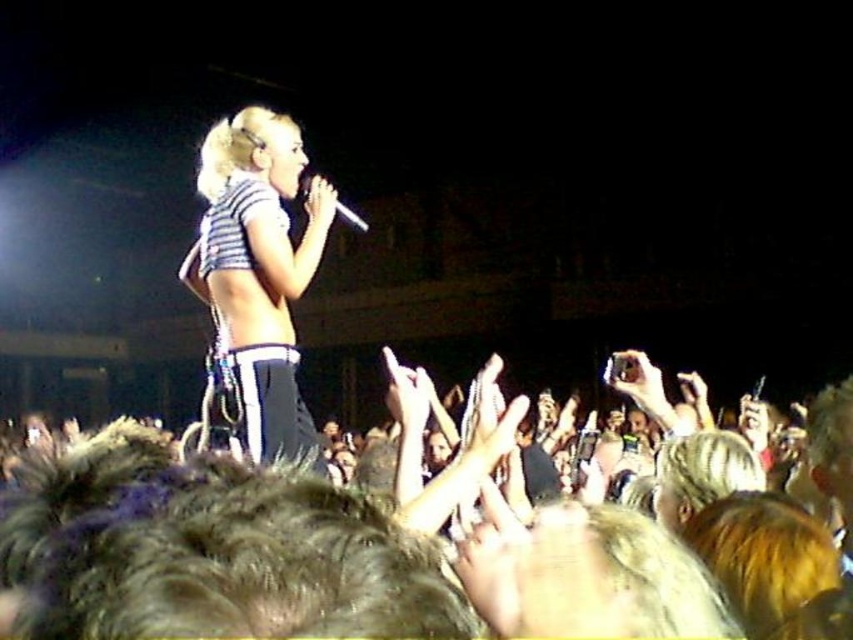
You are a photographer at the concert and want to capture the performer. Which object, the striped fabric top at center or the shiny metallic microphone at center, should you focus on first if you want to photograph the performer from the audience perspective?

The striped fabric top at center is below the shiny metallic microphone at center, so you should focus on the shiny metallic microphone at center first as it is positioned higher and more prominent in the frame.

You are a photographer at the concert. You want to capture a photo where both the striped fabric top at center and the shiny metallic microphone at center are clearly visible. Given their sizes, which object should you focus on to ensure both are in frame?

The striped fabric top at center has a smaller size compared to the shiny metallic microphone at center. To ensure both are in frame, focus on the shiny metallic microphone at center since it is larger and will be easier to capture clearly while the smaller top remains visible.

You are a photographer at the concert and want to capture the performer. Which object should you focus on first, the striped fabric bikini top at center or the shiny metallic microphone at center, if you are using a camera with a shallow depth of field?

The striped fabric bikini top at center is located below the shiny metallic microphone at center. Since the microphone is higher up, it would be in the foreground relative to the bikini top. With a shallow depth of field, the foreground object would be in focus while the background blurs. Therefore, you should focus on the shiny metallic microphone at center first to ensure it is sharp in the photo.